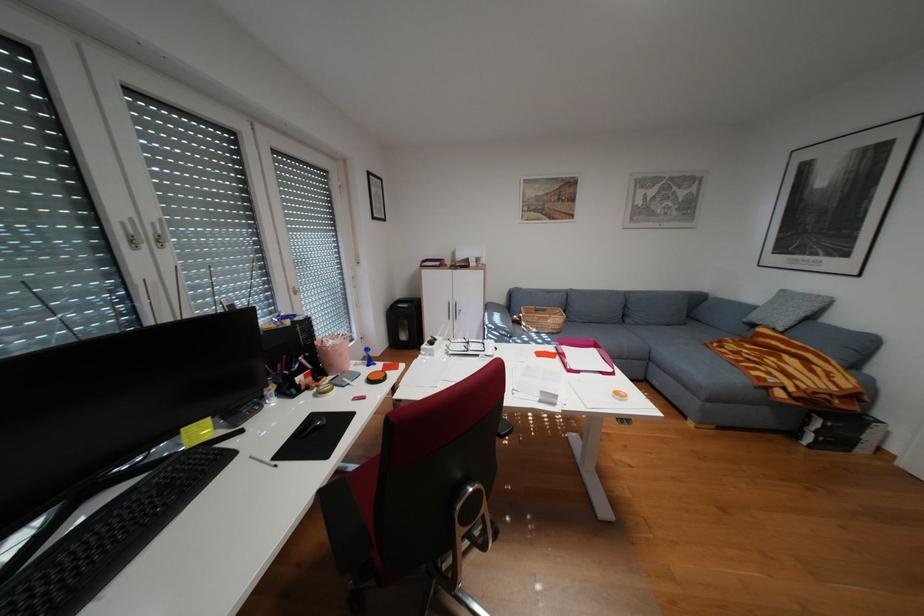
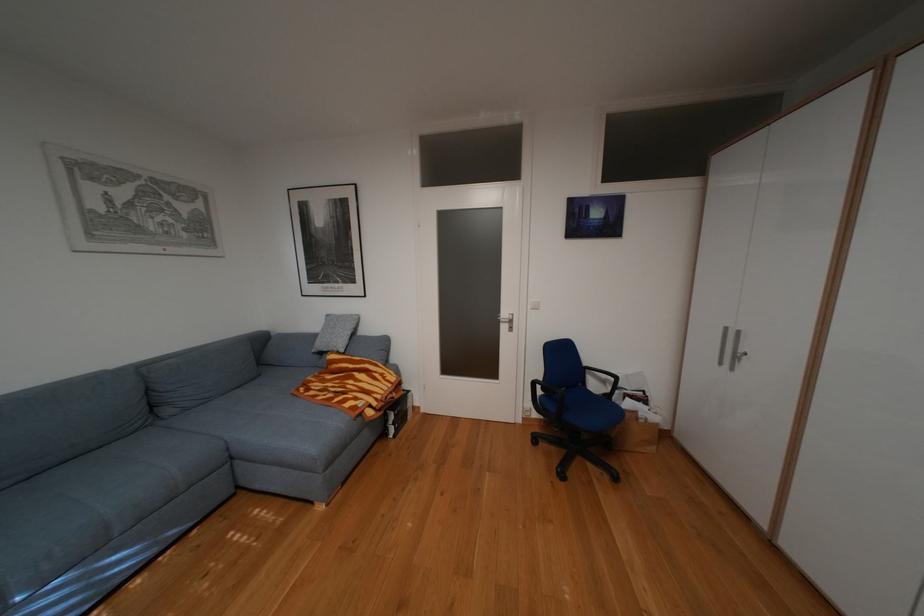
Question: The images are taken continuously from a first-person perspective. In which direction is your viewpoint rotating?

Choices:
 (A) Left
 (B) Right
 (C) Up
 (D) Down

Answer: (B)